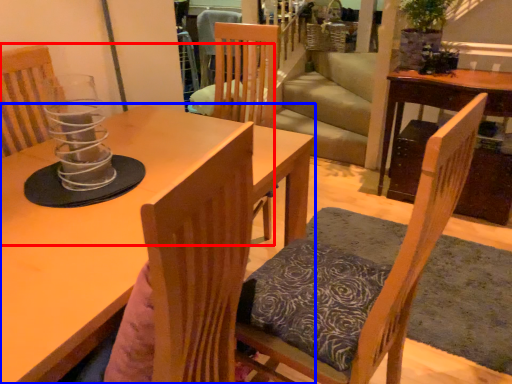
Question: Which of the following is the farthest to the observer, chair (highlighted by a red box) or table (highlighted by a blue box)?

Choices:
 (A) chair
 (B) table

Answer: (A)